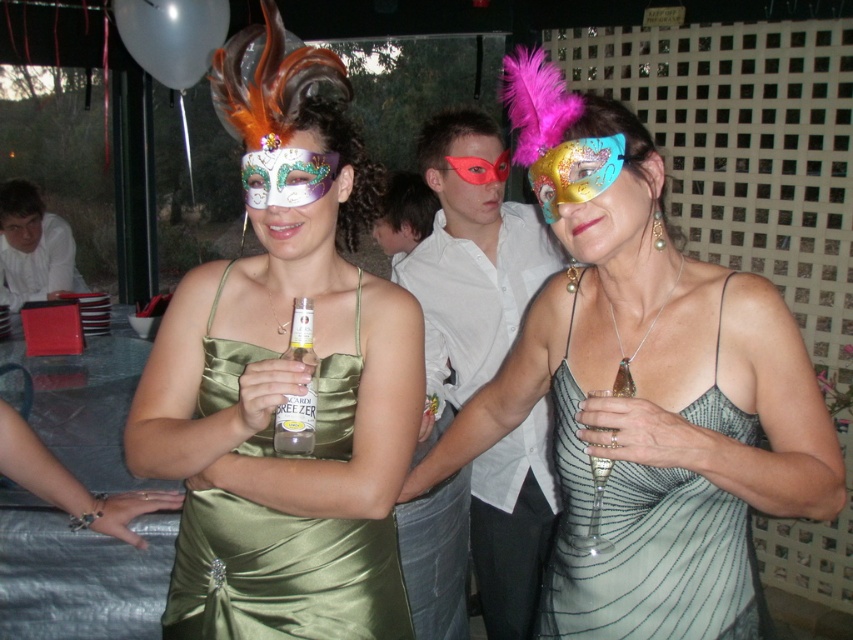
Is matte white mask at center smaller than clear glass bottle at center?

Indeed, matte white mask at center has a smaller size compared to clear glass bottle at center.

Who is higher up, matte white mask at center or clear glass bottle at center?

matte white mask at center

The height and width of the screenshot is (640, 853). In order to click on matte white mask at center in this screenshot , I will do `click(285, 176)`.

Find the location of a particular element. The height and width of the screenshot is (640, 853). white cotton shirt at center is located at coordinates (473, 253).

Is point (543, 493) farther from camera compared to point (277, 134)?

Yes, it is behind point (277, 134).

Measure the distance between white cotton shirt at center and camera.

The distance of white cotton shirt at center from camera is 1.81 meters.

The height and width of the screenshot is (640, 853). Find the location of `white cotton shirt at center`. white cotton shirt at center is located at coordinates (473, 253).

Is satin green dress at center wider than green satin dress at center?

Yes.

Who is positioned more to the left, satin green dress at center or green satin dress at center?

satin green dress at center is more to the left.

Who is more forward, (376,548) or (699,612)?

Positioned in front is point (699,612).

Find the location of a particular element. The width and height of the screenshot is (853, 640). satin green dress at center is located at coordinates (282, 573).